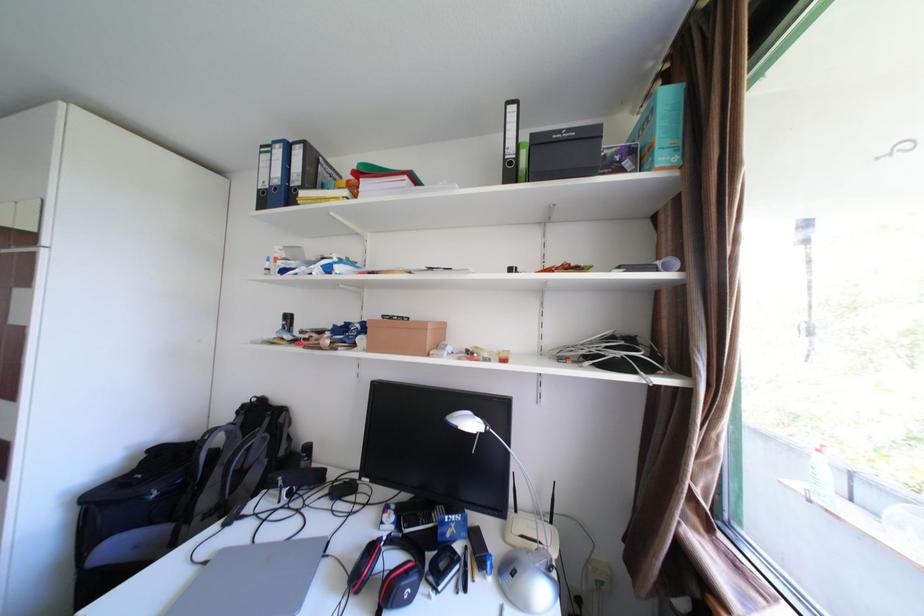
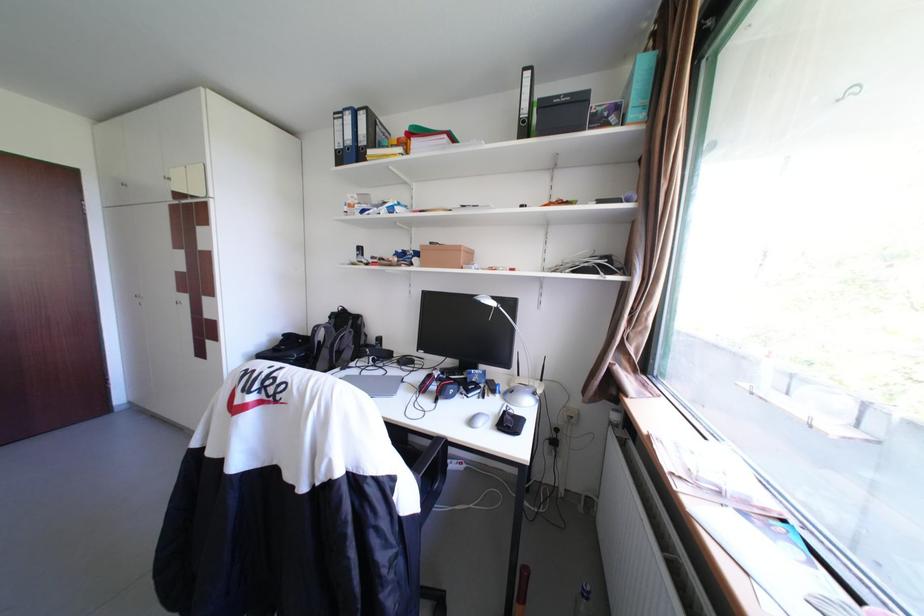
The point at (251, 419) is marked in the first image. Where is the corresponding point in the second image?

(344, 321)